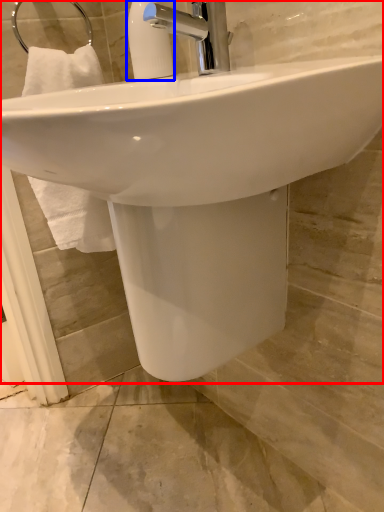
Question: Which object is closer to the camera taking this photo, sink (highlighted by a red box) or soap dispenser (highlighted by a blue box)?

Choices:
 (A) sink
 (B) soap dispenser

Answer: (A)